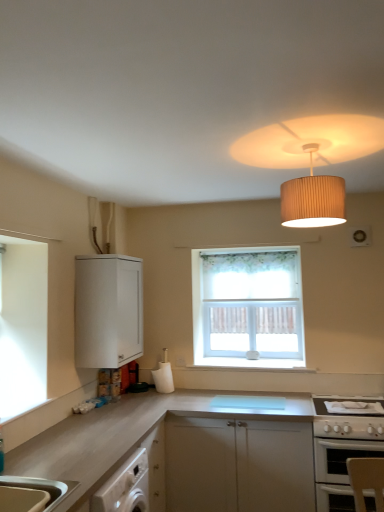
Question: In terms of size, does satin white countertop at center appear bigger or smaller than beige pleated lampshade at upper center?

Choices:
 (A) small
 (B) big

Answer: (B)

Question: From a real-world perspective, is satin white countertop at center physically located above or below beige pleated lampshade at upper center?

Choices:
 (A) below
 (B) above

Answer: (A)

Question: Estimate the real-world distances between objects in this image. Which object is farther from the beige pleated lampshade at upper center?

Choices:
 (A) satin white countertop at center
 (B) white glossy gas stove at lower right
 (C) white floral curtain at center
 (D) white glossy oven at lower right
 (E) white matte cabinet at upper left

Answer: (A)

Question: Which is farther from the white glossy oven at lower right?

Choices:
 (A) white glossy gas stove at lower right
 (B) satin white countertop at center
 (C) white floral curtain at center
 (D) white matte cabinet at upper left
 (E) beige pleated lampshade at upper center

Answer: (D)